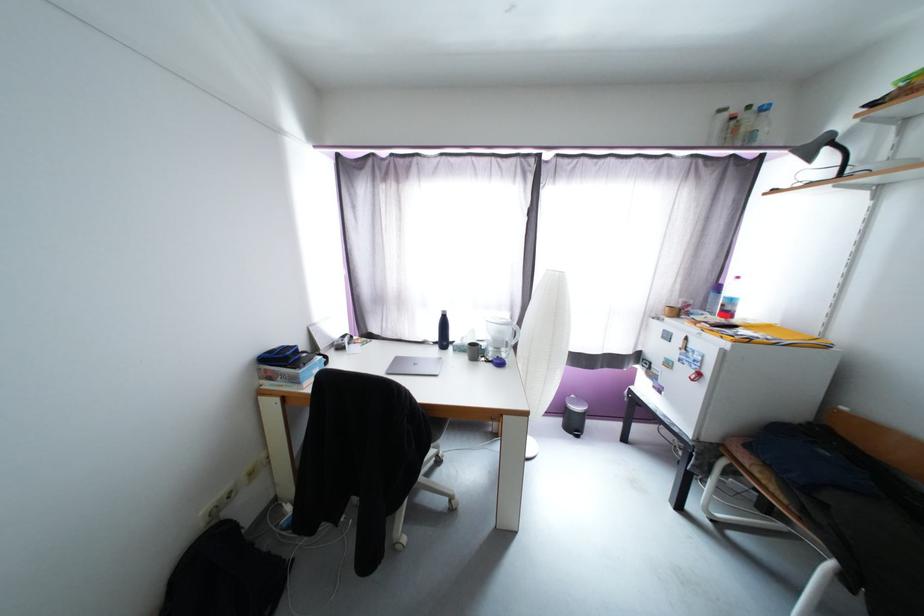
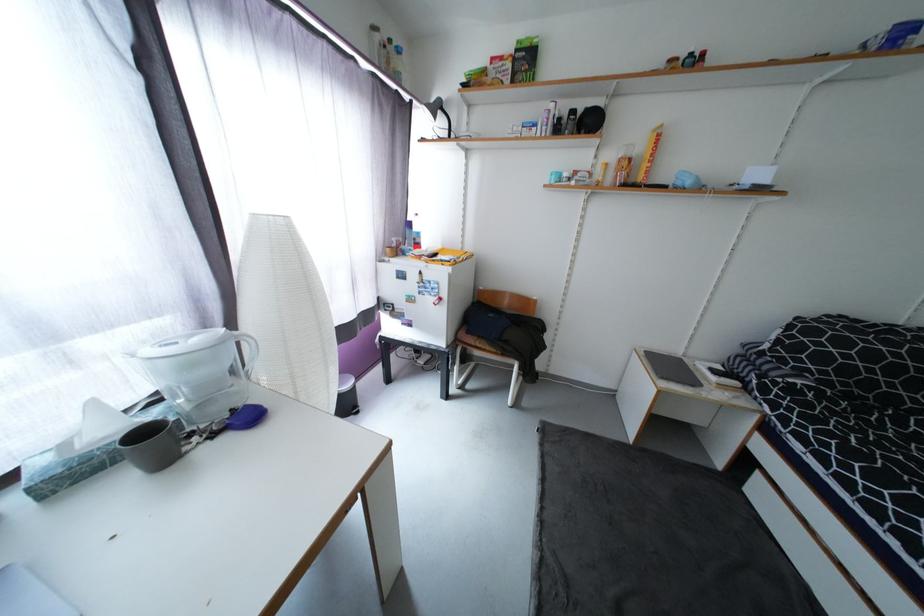
In the second image, find the point that corresponds to [755,342] in the first image.

(460, 264)